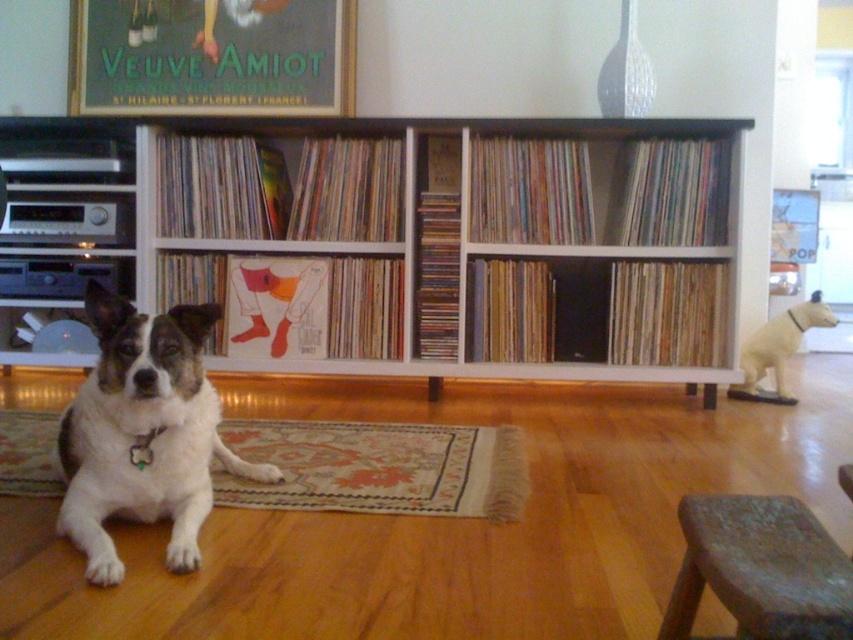
Does point (683, 579) come farther from viewer compared to point (753, 369)?

No, (683, 579) is in front of (753, 369).

Locate an element on the screen. The image size is (853, 640). wooden stool at lower right is located at coordinates (759, 570).

Who is positioned more to the right, white fur dog at center or wooden stool at lower right?

wooden stool at lower right

Can you confirm if white fur dog at center is smaller than wooden stool at lower right?

No, white fur dog at center is not smaller than wooden stool at lower right.

In the scene shown: Who is more forward, (x=144, y=326) or (x=695, y=512)?

Point (x=695, y=512)

The width and height of the screenshot is (853, 640). In order to click on white fur dog at center in this screenshot , I will do `click(143, 433)`.

This screenshot has height=640, width=853. Identify the location of white wood bookcase at center. (465, 237).

Based on the photo, can you confirm if white wood bookcase at center is positioned above white matte dog at right?

Yes, white wood bookcase at center is above white matte dog at right.

Locate an element on the screen. The height and width of the screenshot is (640, 853). white wood bookcase at center is located at coordinates (465, 237).